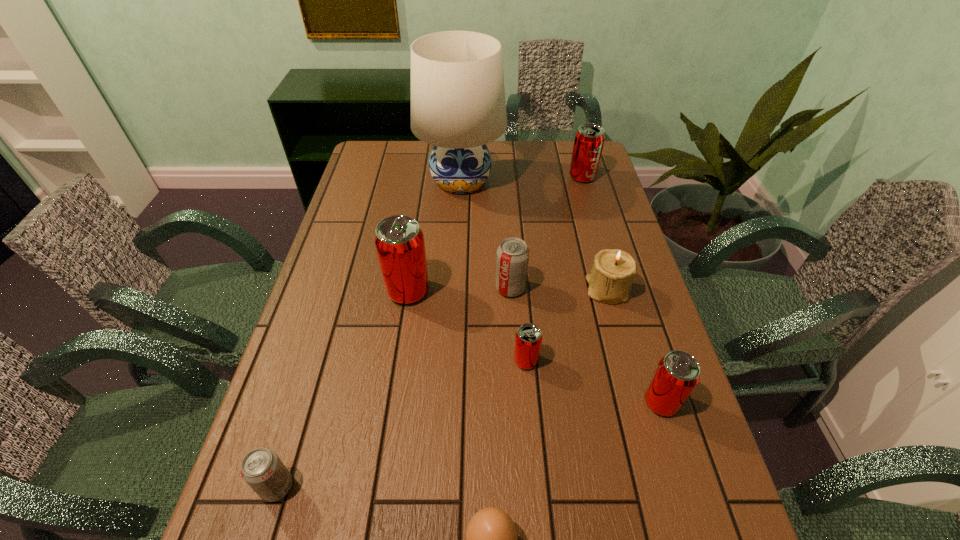
In order to click on the nearest red soda can in this screenshot , I will do `click(677, 373)`.

You are a GUI agent. You are given a task and a screenshot of the screen. Output one action in this format:
    pyautogui.click(x=<x>, y=<y>)
    Task: Click on the third farthest red soda can
    This screenshot has height=540, width=960.
    Given the screenshot: What is the action you would take?
    pyautogui.click(x=528, y=340)

Locate an element on the screen. The height and width of the screenshot is (540, 960). the smallest red soda can is located at coordinates (528, 340).

In order to click on the leftmost object in this screenshot , I will do `click(262, 469)`.

You are a GUI agent. You are given a task and a screenshot of the screen. Output one action in this format:
    pyautogui.click(x=<x>, y=<y>)
    Task: Click on the smaller gray soda can
    
    Given the screenshot: What is the action you would take?
    pyautogui.click(x=262, y=469)

Find the location of a particular element. The height and width of the screenshot is (540, 960). blank area located 0.230m on the front-facing side of the lampshade is located at coordinates (457, 255).

Identify the location of vacant point located 0.330m on the back of the tallest soda can. The image size is (960, 540). coord(421,206).

In order to click on vacant space located 0.240m on the left of the fifth shortest soda can in this screenshot , I will do `click(503, 177)`.

You are a GUI agent. You are given a task and a screenshot of the screen. Output one action in this format:
    pyautogui.click(x=<x>, y=<y>)
    Task: Click on the free space located 0.400m on the back of the candle_holder
    This screenshot has height=540, width=960.
    Given the screenshot: What is the action you would take?
    pyautogui.click(x=581, y=192)

Locate an element on the screen. This screenshot has height=540, width=960. vacant space located on the back of the bigger gray soda can is located at coordinates coord(505,206).